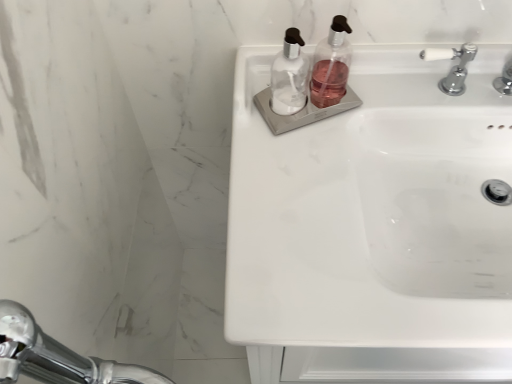
Question: In terms of width, does white ceramic tap at upper right look wider or thinner when compared to white glossy sink at upper right?

Choices:
 (A) thin
 (B) wide

Answer: (A)

Question: In the image, is white ceramic tap at upper right positioned in front of or behind white glossy sink at upper right?

Choices:
 (A) front
 (B) behind

Answer: (B)

Question: Estimate the real-world distances between objects in this image. Which object is closer to the white ceramic tap at upper right?

Choices:
 (A) transparent plastic soap dispenser at upper center, which ranks as the second soap dispenser in left-to-right order
 (B) white glossy sink at upper right
 (C) transparent plastic soap dispenser at center, the second soap dispenser positioned from the right

Answer: (A)

Question: Which of these objects is positioned farthest from the transparent plastic soap dispenser at upper center, marked as the 1th soap dispenser in a right-to-left arrangement?

Choices:
 (A) white ceramic tap at upper right
 (B) white glossy sink at upper right
 (C) transparent plastic soap dispenser at center, the second soap dispenser positioned from the right

Answer: (B)